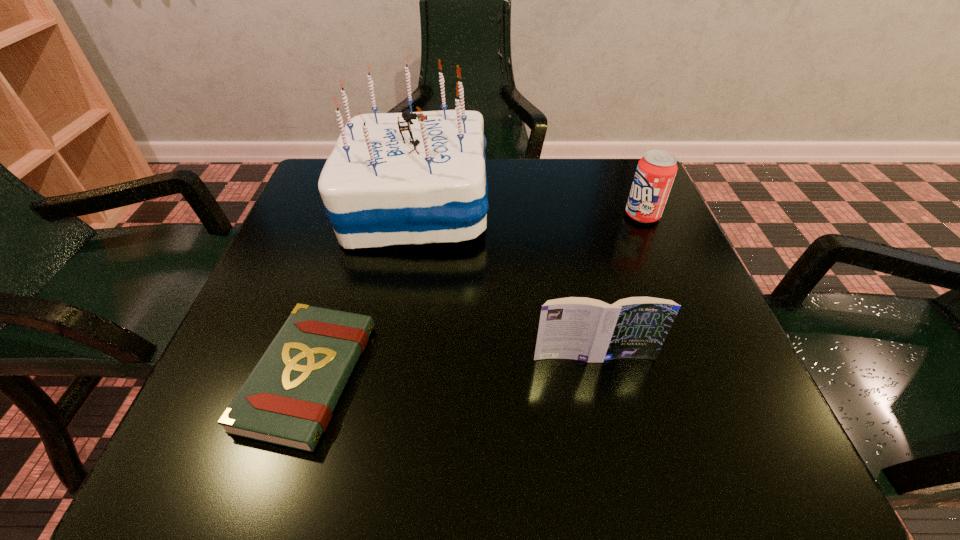
At what (x,y) coordinates should I click in order to perform the action: click on the tallest object. Please return your answer as a coordinate pair (x, y). The width and height of the screenshot is (960, 540). Looking at the image, I should click on (404, 178).

Where is `soda can`? Image resolution: width=960 pixels, height=540 pixels. soda can is located at coordinates (656, 170).

Find the location of a particular element. the right book is located at coordinates (579, 328).

Locate an element on the screen. the third object from left to right is located at coordinates (579, 328).

I want to click on the shortest object, so click(x=288, y=399).

This screenshot has width=960, height=540. Find the location of `the left book`. the left book is located at coordinates (288, 399).

Locate an element on the screen. blank space located on the front of the birthday cake is located at coordinates (401, 280).

Find the location of `vacant space located 0.340m on the surface of the soda can`. vacant space located 0.340m on the surface of the soda can is located at coordinates (472, 215).

Locate an element on the screen. This screenshot has height=540, width=960. vacant space located 0.100m on the surface of the soda can is located at coordinates (580, 215).

Locate an element on the screen. This screenshot has height=540, width=960. free region located on the surface of the soda can is located at coordinates (576, 215).